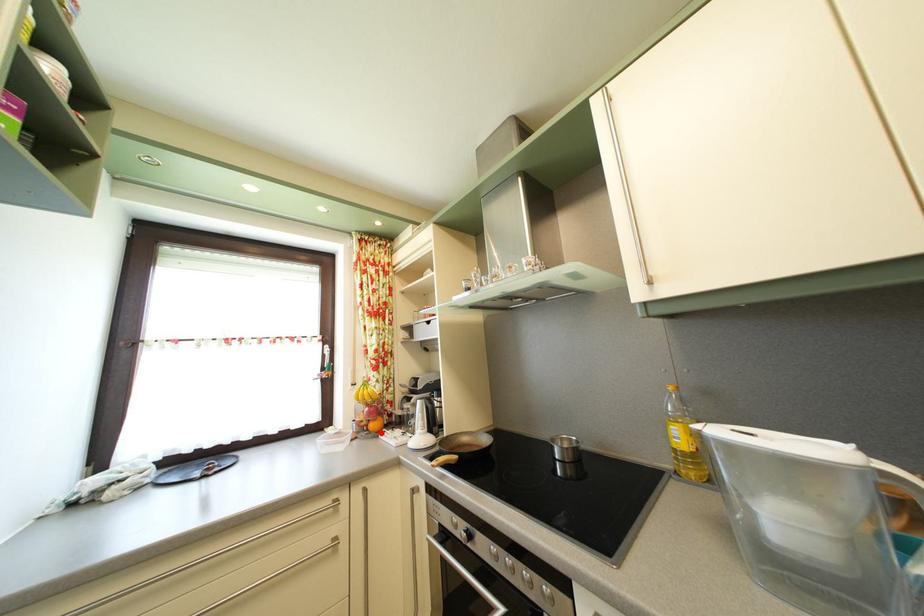
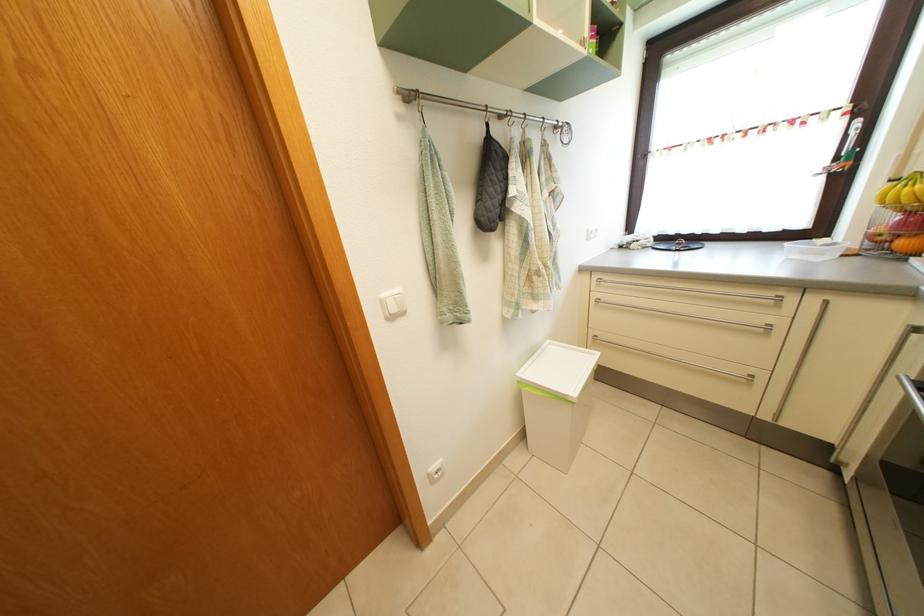
Where in the second image is the point corresponding to the highlighted location from the first image?

(910, 252)